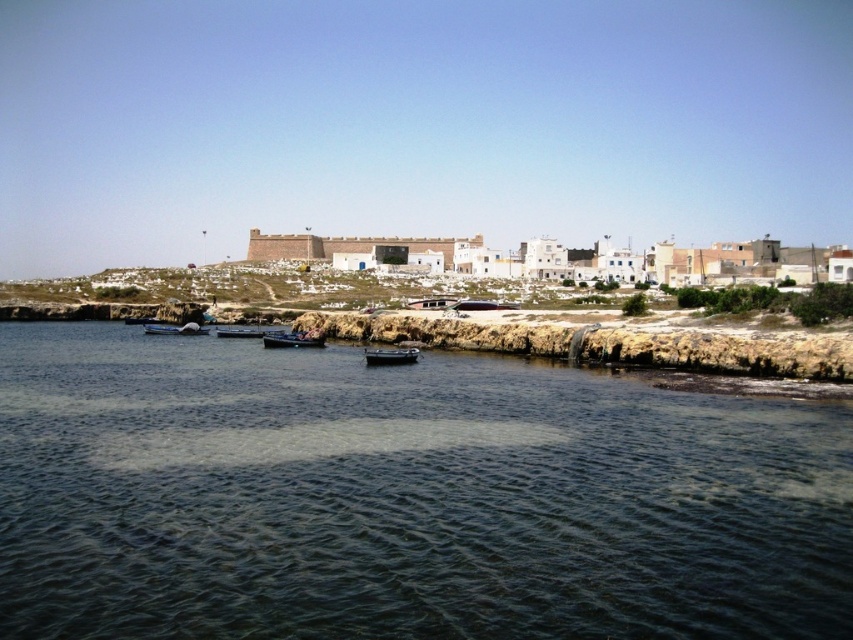
You are a photographer planning to capture the wooden boat at center in your shot. The camera you are using has a focal length of 50mm. If the boat is located at coordinates point 0.519, 0.292, can you estimate whether the boat will be in the center of the frame?

The wooden boat at center is positioned at point (x=248, y=332), which is very close to the center coordinates of the frame. Therefore, the boat will be centered in the photograph.

You are a photographer planning to capture the entire scene in one shot. Given that the dark green water at center and the black rubber boat at lower center must both be visible, which object will occupy more of the frame?

The dark green water at center will occupy more of the frame because it is larger in size than the black rubber boat at lower center according to the description.